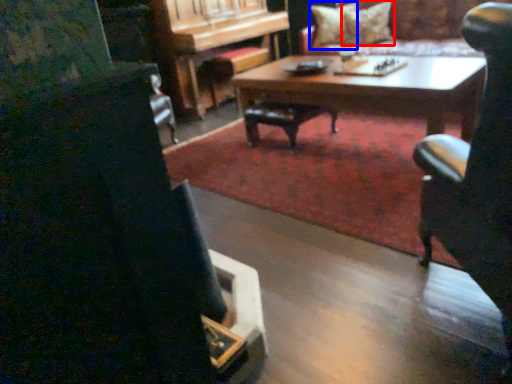
Question: Which point is further to the camera, pillow (highlighted by a red box) or pillow (highlighted by a blue box)?

Choices:
 (A) pillow
 (B) pillow

Answer: (B)